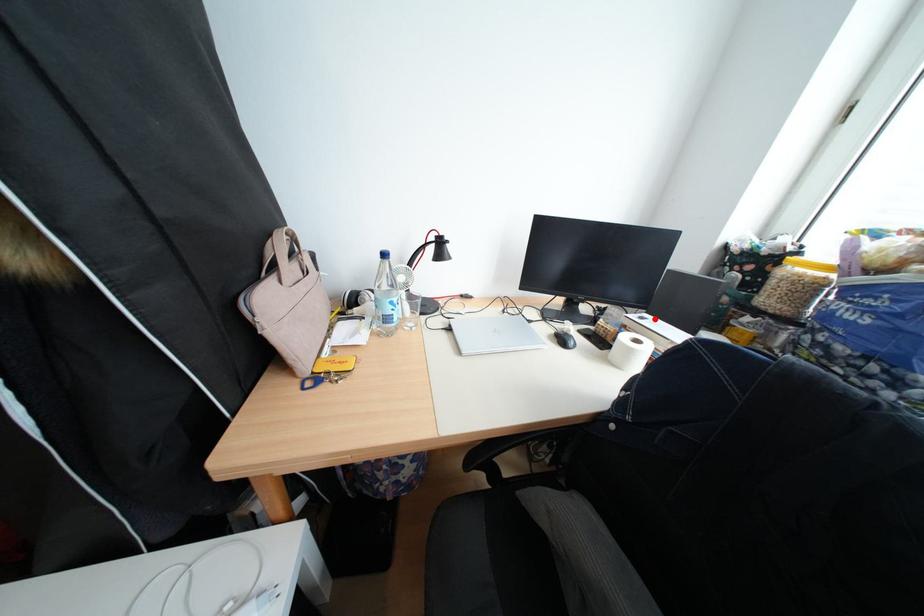
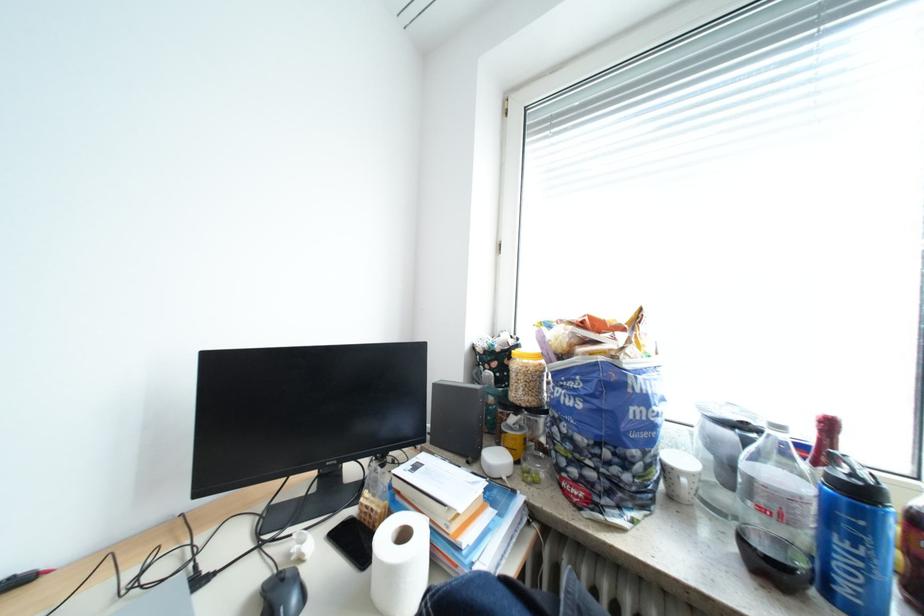
In the second image, find the point that corresponds to the highlighted location in the first image.

(428, 468)